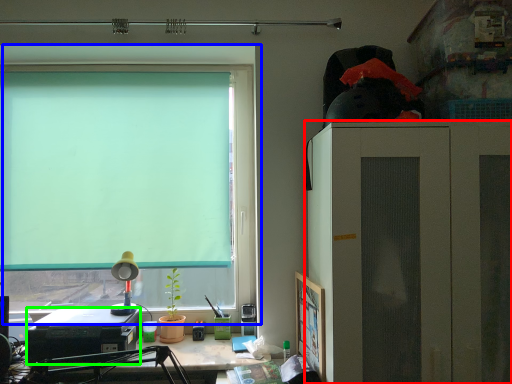
Question: Estimate the real-world distances between objects in this image. Which object is farther from cabinetry (highlighted by a red box), window (highlighted by a blue box) or laptop (highlighted by a green box)?

Choices:
 (A) window
 (B) laptop

Answer: (B)